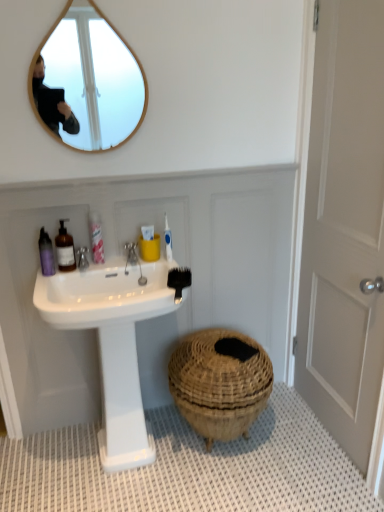
Question: Visually, is translucent glass soap dispenser at left, which ranks as the second toiletry in left-to-right order, positioned to the left or to the right of matte purple bottle at upper left, which is the 1th toiletry from left to right?

Choices:
 (A) right
 (B) left

Answer: (A)

Question: Based on their sizes in the image, would you say translucent glass soap dispenser at left, which ranks as the second toiletry in left-to-right order, is bigger or smaller than matte purple bottle at upper left, which is the 3th toiletry from right to left?

Choices:
 (A) big
 (B) small

Answer: (A)

Question: Considering the real-world distances, which object is closest to the white matte door at right?

Choices:
 (A) silver metallic faucet at sink left
 (B) silver metallic faucet at upper center
 (C) pink plastic bottle at upper left, the 3th toiletry in the left-to-right sequence
 (D) black plastic comb at upper center
 (E) translucent glass soap dispenser at left, which ranks as the second toiletry in left-to-right order

Answer: (D)

Question: Based on their relative distances, which object is farther from the black plastic comb at upper center?

Choices:
 (A) teak wood mirror at upper left
 (B) white matte door at right
 (C) matte purple bottle at upper left, which is the 1th toiletry from left to right
 (D) silver metallic faucet at upper center
 (E) white textured bath mat at lower center

Answer: (A)